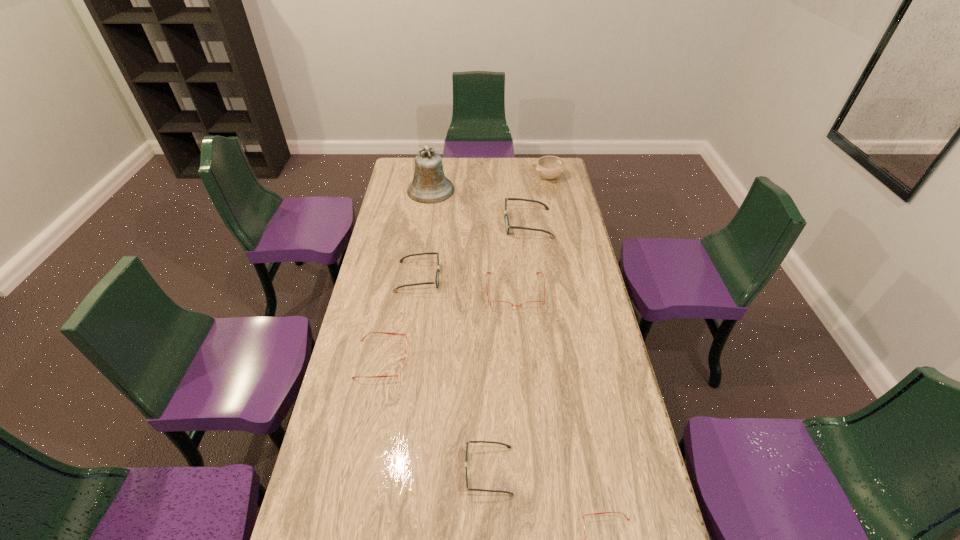
Locate an element on the screen. This screenshot has width=960, height=540. vacant space at the far edge is located at coordinates (511, 174).

The width and height of the screenshot is (960, 540). What are the coordinates of `free space at the left edge of the desktop` in the screenshot? It's located at pyautogui.click(x=407, y=200).

In the image, there is a desktop. Where is `free space at the right edge`? The width and height of the screenshot is (960, 540). free space at the right edge is located at coordinates (649, 502).

Where is `vacant area between the second pink spectacles from right to left and the bell`? This screenshot has width=960, height=540. vacant area between the second pink spectacles from right to left and the bell is located at coordinates (473, 241).

Where is `free space between the second gray spectacles from right to left and the biggest gray spectacles`? free space between the second gray spectacles from right to left and the biggest gray spectacles is located at coordinates (508, 347).

At what (x,y) coordinates should I click in order to perform the action: click on free point between the second farthest pink spectacles and the bowl. Please return your answer as a coordinate pair (x, y). Looking at the image, I should click on (466, 268).

You are a GUI agent. You are given a task and a screenshot of the screen. Output one action in this format:
    pyautogui.click(x=<x>, y=<y>)
    Task: Click on the free space between the tallest object and the farthest spectacles
    Image resolution: width=960 pixels, height=540 pixels.
    Given the screenshot: What is the action you would take?
    pyautogui.click(x=479, y=207)

Identify the location of free space between the nearest gray spectacles and the second pink spectacles from right to left. (502, 381).

At what (x,y) coordinates should I click in order to perform the action: click on vacant point located between the second gray spectacles from left to right and the second farthest pink spectacles. Please return your answer as a coordinate pair (x, y). Image resolution: width=960 pixels, height=540 pixels. Looking at the image, I should click on (435, 415).

Where is `unoccupied position between the second nearest object and the tallest object`? Image resolution: width=960 pixels, height=540 pixels. unoccupied position between the second nearest object and the tallest object is located at coordinates (460, 330).